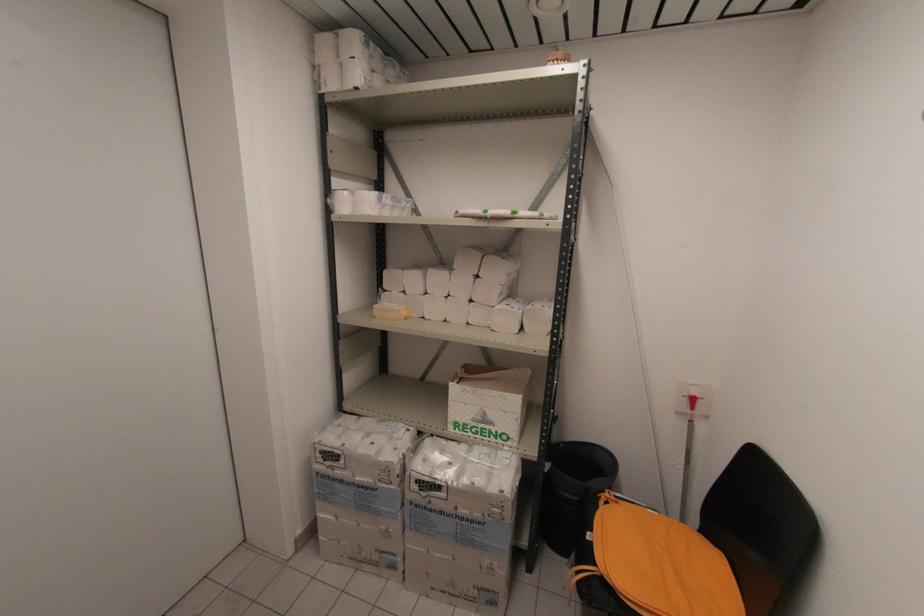
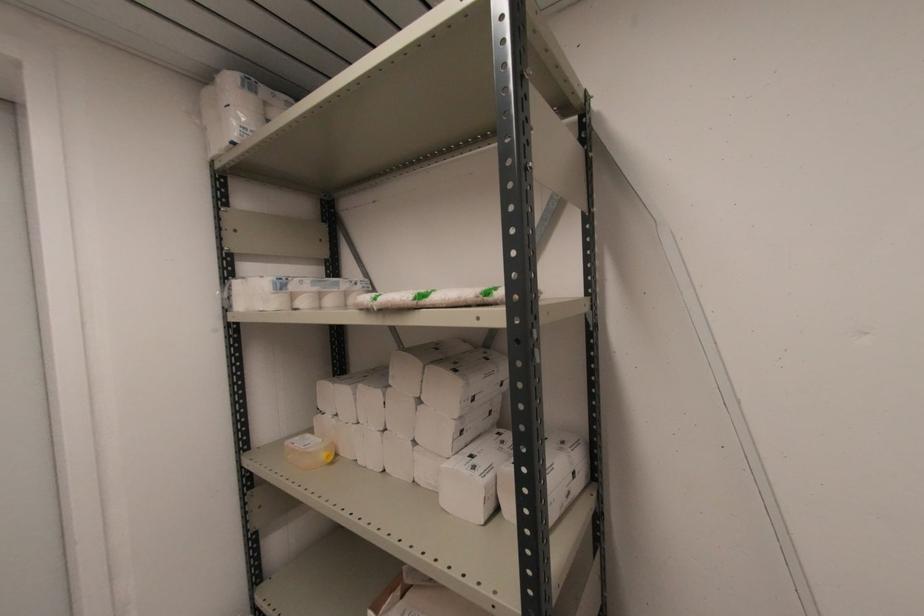
Question: The first image is from the beginning of the video and the second image is from the end. How did the camera likely rotate when shooting the video?

Choices:
 (A) Left
 (B) Right
 (C) Up
 (D) Down

Answer: (A)